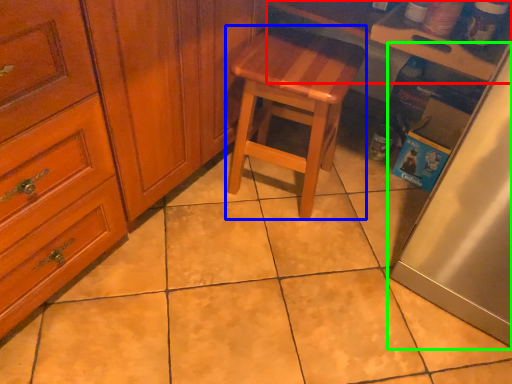
Question: Which is nearer to the counter top (highlighted by a red box)? stool (highlighted by a blue box) or fridge (highlighted by a green box).

Choices:
 (A) stool
 (B) fridge

Answer: (A)